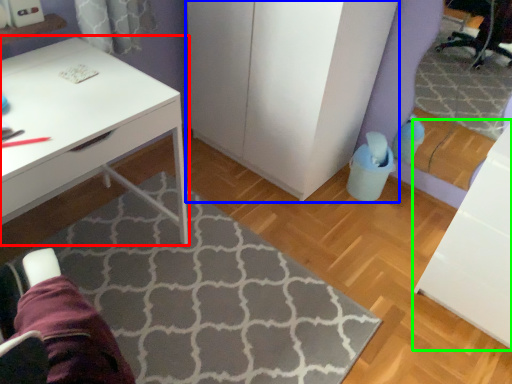
Question: Considering the real-world distances, which object is closest to desk (highlighted by a red box)? dresser (highlighted by a blue box) or file cabinet (highlighted by a green box).

Choices:
 (A) dresser
 (B) file cabinet

Answer: (A)